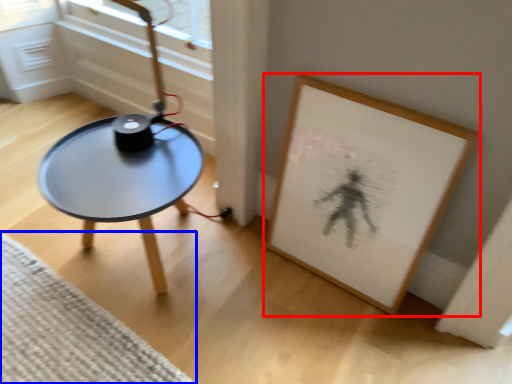
Question: Among these objects, which one is nearest to the camera, picture frame (highlighted by a red box) or mat (highlighted by a blue box)?

Choices:
 (A) picture frame
 (B) mat

Answer: (A)